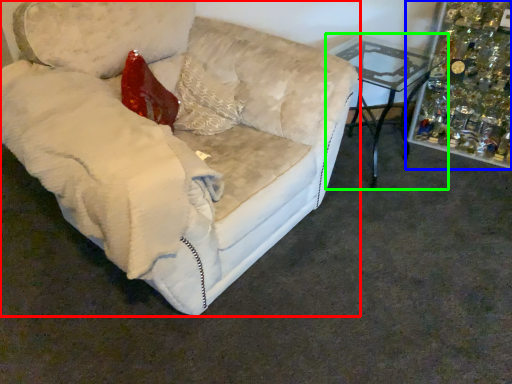
Question: Based on their relative distances, which object is nearer to studio couch (highlighted by a red box)? Choose from christmas decoration (highlighted by a blue box) and table (highlighted by a green box).

Choices:
 (A) christmas decoration
 (B) table

Answer: (B)